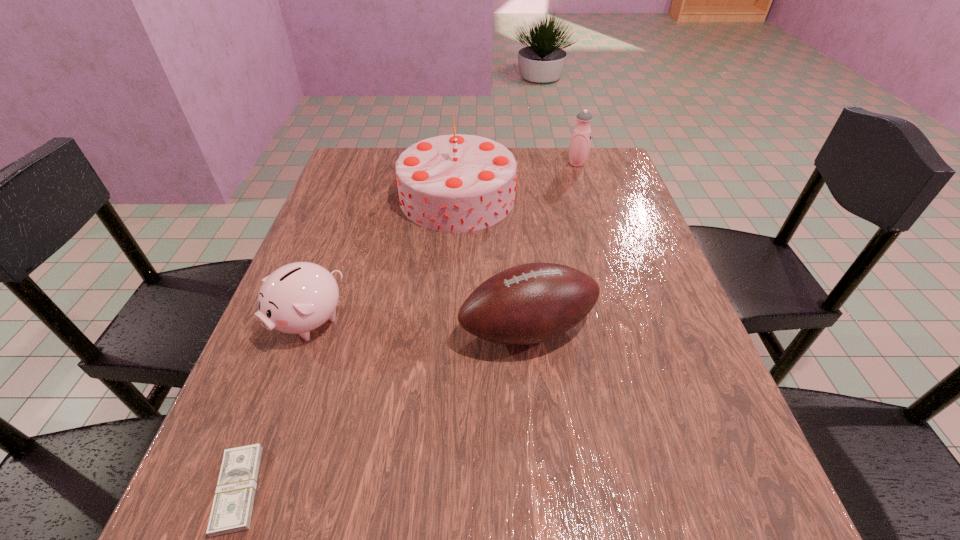
Identify the location of blank region between the thermos bottle and the football (American). The width and height of the screenshot is (960, 540). (552, 246).

The height and width of the screenshot is (540, 960). Find the location of `unoccupied area between the nearest object and the piggy bank`. unoccupied area between the nearest object and the piggy bank is located at coordinates (274, 406).

In order to click on vacant space in between the thermos bottle and the football (American) in this screenshot , I will do `click(552, 246)`.

Where is `vacant space in between the football (American) and the shortest object`? vacant space in between the football (American) and the shortest object is located at coordinates (383, 409).

Image resolution: width=960 pixels, height=540 pixels. Identify the location of empty space that is in between the thermos bottle and the football (American). (552, 246).

Select which object is the third closest to the piggy bank. Please provide its 2D coordinates. Your answer should be formatted as a tuple, i.e. [(x, y)], where the tuple contains the x and y coordinates of a point satisfying the conditions above.

[(531, 303)]

Identify the location of object that is the closest one to the football (American). (456, 183).

What are the coordinates of `free space that satisfies the following two spatial constraints: 1. on the back side of the piggy bank; 2. on the left side of the tallest object` in the screenshot? It's located at (354, 197).

This screenshot has height=540, width=960. In order to click on free space that satisfies the following two spatial constraints: 1. on the front side of the piggy bank; 2. on the right side of the football (American) in this screenshot , I will do (306, 329).

Identify the location of vacant region that satisfies the following two spatial constraints: 1. on the front side of the football (American); 2. on the left side of the piggy bank. (306, 329).